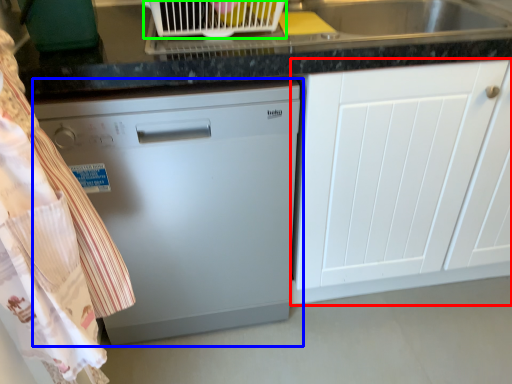
Question: Which is farther away from cabinetry (highlighted by a red box)? home appliance (highlighted by a blue box) or appliance (highlighted by a green box)?

Choices:
 (A) home appliance
 (B) appliance

Answer: (B)